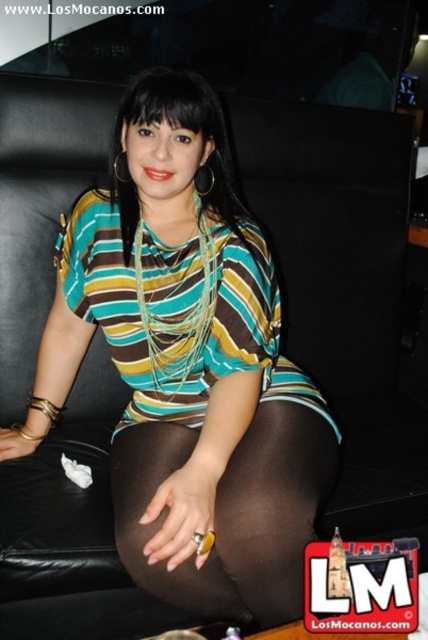
You are a fashion designer observing the person in the image. You need to determine if the striped fabric shirt at center can be seen through the brown sheer tights at center. Can you confirm this?

The striped fabric shirt at center is positioned over brown sheer tights at center, so the shirt is worn on top of the tights. Since the tights are sheer, the stripes from the shirt may be visible through them depending on the fabric opacity. However, the description does not specify the tights opacity, so we cannot confirm visibility.

You are a fashion designer trying to create a new outfit. You have a striped fabric shirt at center and brown sheer tights at center. Which item would you choose if you want to use a larger piece of fabric?

The striped fabric shirt at center is bigger than the brown sheer tights at center, so you should choose the striped fabric shirt at center for a larger piece of fabric.

You are an interior designer assessing the placement of a new lamp in the room. The lamp has a base that is 0.3 meters in diameter. The point where the striped fabric shirt at center is located is at coordinates point [187,365]. If you want to place the lamp so that it is equidistant from the striped fabric shirt at center and the edge of the room, is this possible?

The striped fabric shirt at center is located at point [187,365]. To place the lamp equidistant from this point and the edge of the room, the lamp must be positioned along the perpendicular bisector of the line segment connecting the shirt point and the nearest edge. Since the room dimensions are not provided, it is impossible to determine if this placement is feasible.